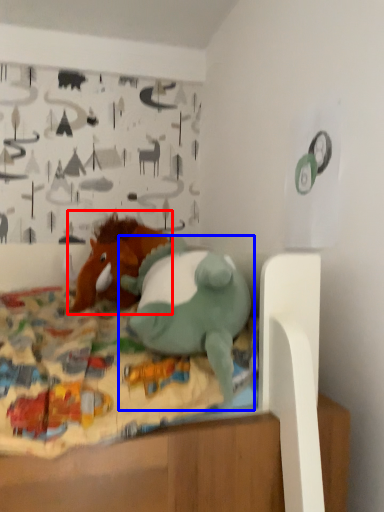
Question: Which of the following is the closest to the observer, toy (highlighted by a red box) or toy (highlighted by a blue box)?

Choices:
 (A) toy
 (B) toy

Answer: (B)